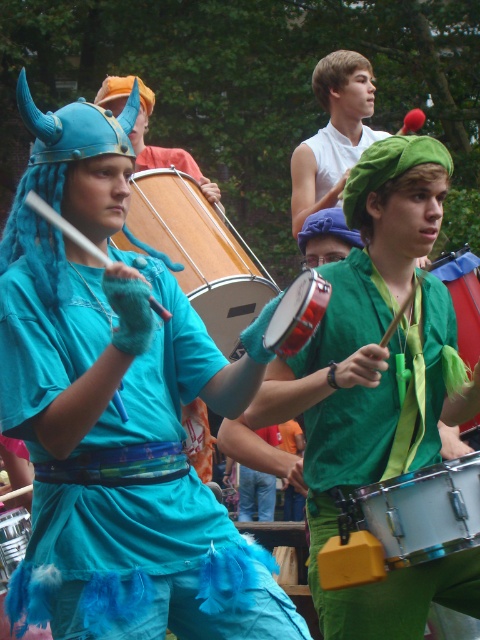
Does matte blue fabric at center appear on the right side of shiny silver drum at center?

In fact, matte blue fabric at center is to the left of shiny silver drum at center.

Describe the element at coordinates (124, 529) in the screenshot. I see `matte blue fabric at center` at that location.

Find the location of a particular element. The height and width of the screenshot is (640, 480). matte blue fabric at center is located at coordinates (124, 529).

Measure the distance between wooden drum at center and white smooth shirt at upper center.

wooden drum at center and white smooth shirt at upper center are 5.56 feet apart from each other.

Is wooden drum at center positioned before white smooth shirt at upper center?

Yes, wooden drum at center is closer to the viewer.

Between point (229, 360) and point (348, 168), which one is positioned in front?

Point (348, 168) is more forward.

The width and height of the screenshot is (480, 640). Identify the location of wooden drum at center. click(x=199, y=252).

Based on the photo, can you confirm if matte blue fabric at center is wider than brushed metal drum at lower left?

Correct, the width of matte blue fabric at center exceeds that of brushed metal drum at lower left.

Can you confirm if matte blue fabric at center is positioned to the left of brushed metal drum at lower left?

In fact, matte blue fabric at center is to the right of brushed metal drum at lower left.

Who is more distant from viewer, (x=170, y=566) or (x=3, y=579)?

The point (x=3, y=579) is more distant.

The height and width of the screenshot is (640, 480). In order to click on matte blue fabric at center in this screenshot , I will do `click(124, 529)`.